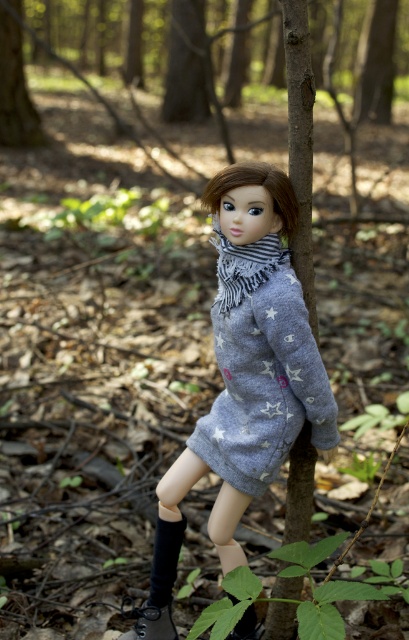
You are a photographer setting up a shoot in the forest. You want to ensure the gray soft fabric dress at center is visible in the frame. Since the brown rough bark at upper left is blocking part of the dress, where should you position the camera relative to the tree trunk to avoid the bark obscuring the dress?

To avoid the brown rough bark at upper left blocking the gray soft fabric dress at center, position the camera so that it is angled downward, as the gray soft fabric dress at center is positioned under the brown rough bark at upper left.

You are a photographer trying to capture the brown rough bark at upper left and the gray striped scarf at center in a single frame. Which object will appear wider in the photo?

The brown rough bark at upper left will appear wider in the photo because its width surpasses that of the gray striped scarf at center.